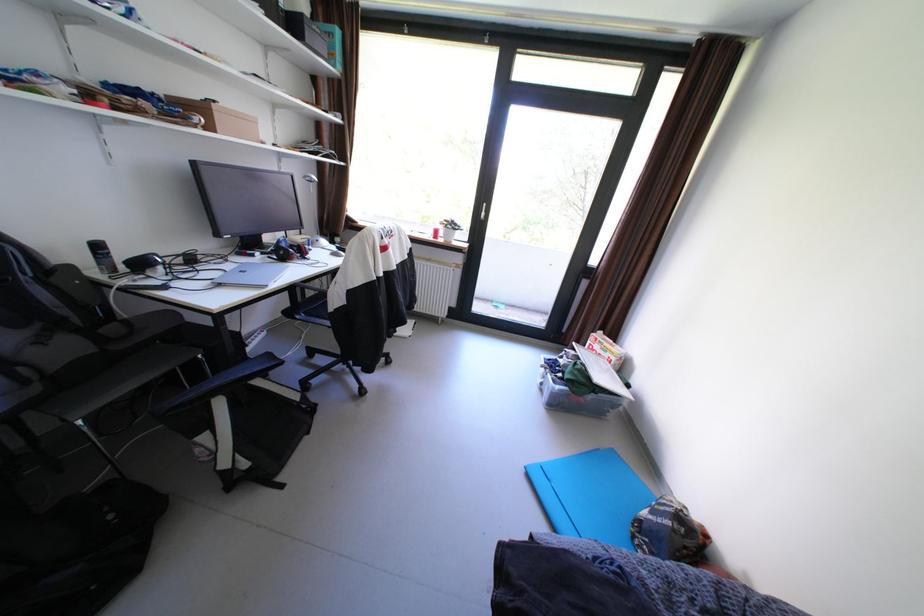
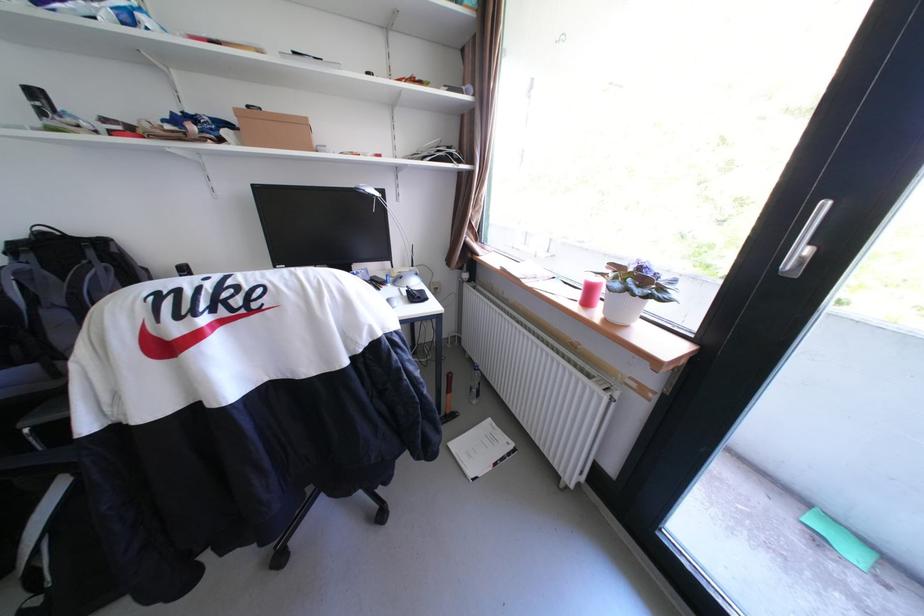
Question: I am providing you with two images of the same scene from different viewpoints. After the viewpoint changes to image2, which objects are now occluded?

Choices:
 (A) silver pan handle
 (B) cardboard box
 (C) red headphones
 (D) white paper booklet

Answer: (C)